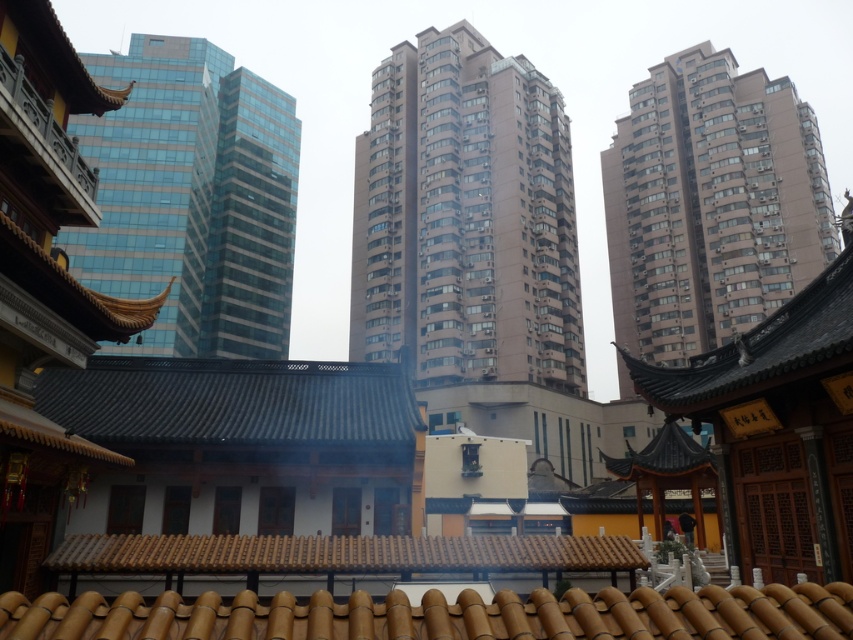
Question: Which is nearer to the blue glass building at left?

Choices:
 (A) beige concrete building at center
 (B) brown textured building at upper right

Answer: (A)

Question: Which of the following is the closest to the observer?

Choices:
 (A) beige concrete building at center
 (B) brown textured building at upper right

Answer: (A)

Question: Which object is the closest to the blue glass building at left?

Choices:
 (A) brown textured building at upper right
 (B) beige concrete building at center

Answer: (B)

Question: Is blue glass building at left to the left of brown textured building at upper right from the viewer's perspective?

Choices:
 (A) yes
 (B) no

Answer: (A)

Question: Is beige concrete building at center below brown textured building at upper right?

Choices:
 (A) no
 (B) yes

Answer: (A)

Question: Can you confirm if beige concrete building at center is bigger than blue glass building at left?

Choices:
 (A) no
 (B) yes

Answer: (B)